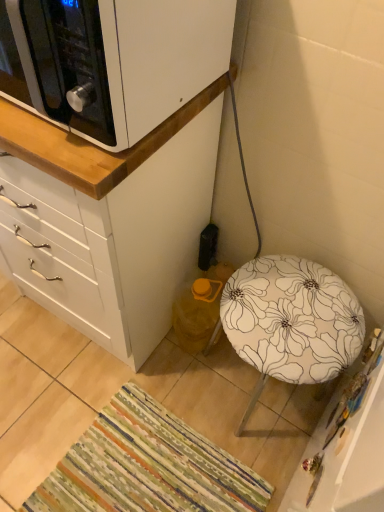
This screenshot has width=384, height=512. Find the location of `vacant space situated above white floral fabric stool at lower right (from a real-world perspective)`. vacant space situated above white floral fabric stool at lower right (from a real-world perspective) is located at coordinates (299, 306).